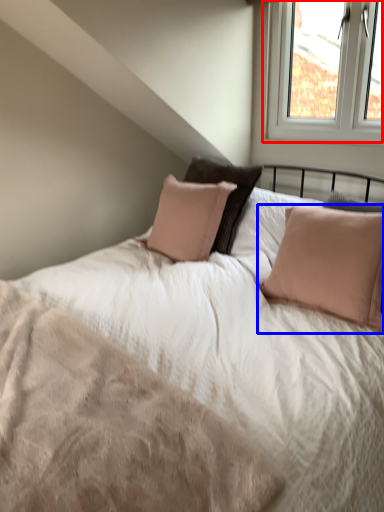
Question: Which object is closer to the camera taking this photo, window (highlighted by a red box) or pillow (highlighted by a blue box)?

Choices:
 (A) window
 (B) pillow

Answer: (B)